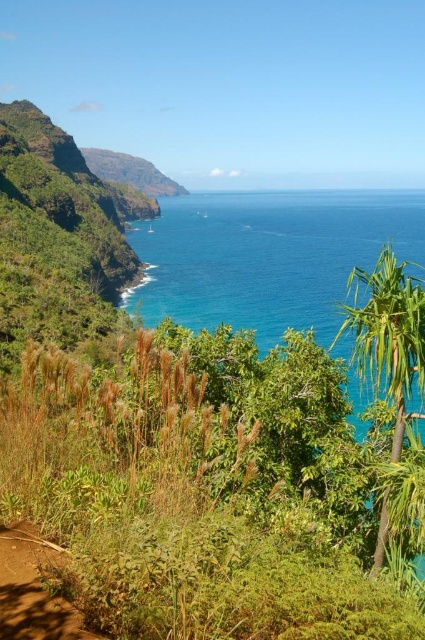
You are a hiker who wants to cross from the green grassy shrubs at lower left to the blue glossy water at center. Considering their heights, which one is shorter and would make it easier to step down?

The green grassy shrubs at lower left are shorter than the blue glossy water at center, so stepping down from the shrubs to the water would be easier.

Consider the image. You are standing at the edge of the cliff looking down at the green grassy shrubs at lower left and the blue glossy water at center. Which of these two objects appears wider from your vantage point?

The blue glossy water at center appears wider than the green grassy shrubs at lower left.